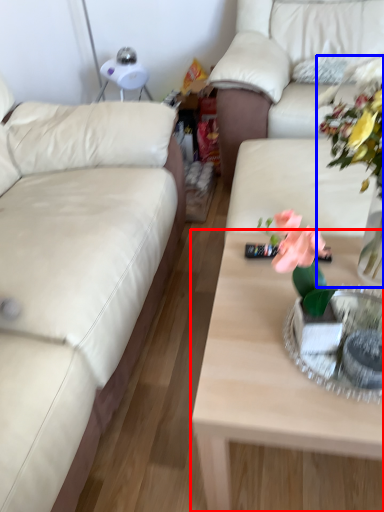
Question: Which object appears farthest to the camera in this image, coffee table (highlighted by a red box) or floral arrangement (highlighted by a blue box)?

Choices:
 (A) coffee table
 (B) floral arrangement

Answer: (A)